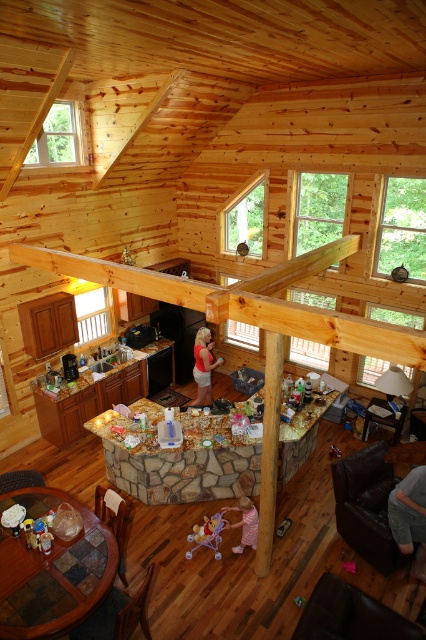
Question: Considering the real-world distances, which object is farthest from the pink fabric dress at lower center?

Choices:
 (A) gray cotton shirt at lower right
 (B) matte red blouse at center
 (C) brown wooden beam at center

Answer: (B)

Question: Estimate the real-world distances between objects in this image. Which object is closer to the stonework/dark wood dining table at center?

Choices:
 (A) brown wooden beam at center
 (B) glass mosaic dining table at lower left
 (C) matte red blouse at center
 (D) pink fabric dress at lower center

Answer: (D)

Question: Does stonework/dark wood dining table at center have a smaller size compared to matte red blouse at center?

Choices:
 (A) yes
 (B) no

Answer: (B)

Question: Among these objects, which one is nearest to the camera?

Choices:
 (A) matte red blouse at center
 (B) stonework/dark wood dining table at center
 (C) wooden beam at center
 (D) glass mosaic dining table at lower left

Answer: (C)

Question: Does wooden beam at center lie in front of brown wooden beam at center?

Choices:
 (A) yes
 (B) no

Answer: (A)

Question: Can you confirm if stonework/dark wood dining table at center is positioned below gray cotton shirt at lower right?

Choices:
 (A) no
 (B) yes

Answer: (A)